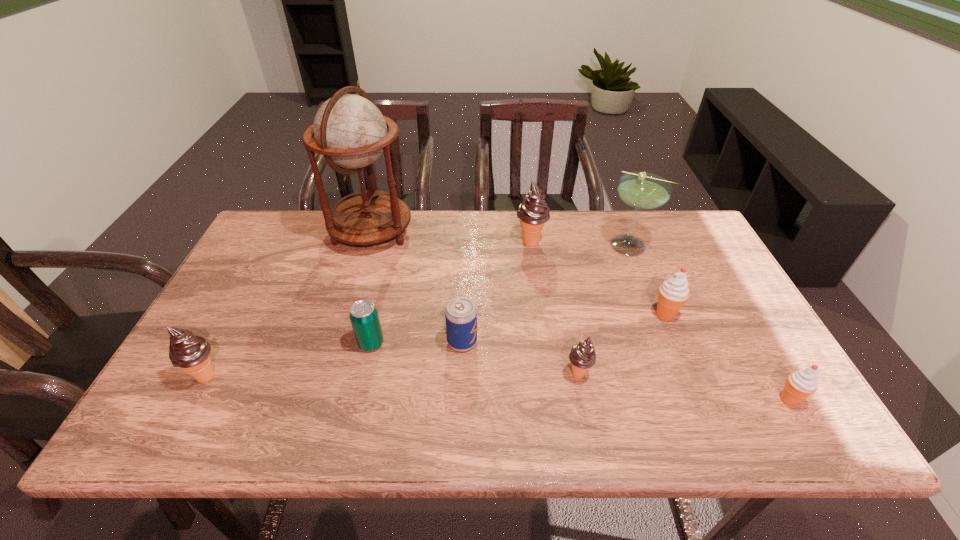
You are a GUI agent. You are given a task and a screenshot of the screen. Output one action in this format:
    pyautogui.click(x=<x>, y=<y>)
    Task: Click on the chocolate icecream object that ranks as the third closest to the smaller red icecream
    
    Given the screenshot: What is the action you would take?
    coord(190,353)

Locate an element on the screen. chocolate icecream that is the second nearest to the biggest chocolate icecream is located at coordinates (190, 353).

What are the coordinates of `free spot that satisfies the following two spatial constraints: 1. on the surface of the farthest chocolate icecream; 2. on the left side of the tallest object` in the screenshot? It's located at coord(369,242).

The width and height of the screenshot is (960, 540). Identify the location of free space that satisfies the following two spatial constraints: 1. on the back side of the leftmost chocolate icecream; 2. on the right side of the smallest chocolate icecream. (207, 374).

What are the coordinates of `free space that satisfies the following two spatial constraints: 1. on the back side of the right beer can; 2. on the right side of the bigger red icecream` in the screenshot? It's located at (464, 315).

Identify the location of vacant space that satisfies the following two spatial constraints: 1. on the front side of the nearer red icecream; 2. on the right side of the farther red icecream. This screenshot has width=960, height=540. (700, 400).

Image resolution: width=960 pixels, height=540 pixels. What are the coordinates of `vacant area that satisfies the following two spatial constraints: 1. on the back side of the fourth object from left to right; 2. on the surface of the tallest object` in the screenshot? It's located at (467, 232).

Locate an element on the screen. This screenshot has height=540, width=960. vacant space that satisfies the following two spatial constraints: 1. on the surface of the biggest chocolate icecream; 2. on the left side of the tallest object is located at coordinates (369, 242).

This screenshot has height=540, width=960. I want to click on free space that satisfies the following two spatial constraints: 1. on the surface of the teal beer can; 2. on the left side of the tallest object, so click(339, 343).